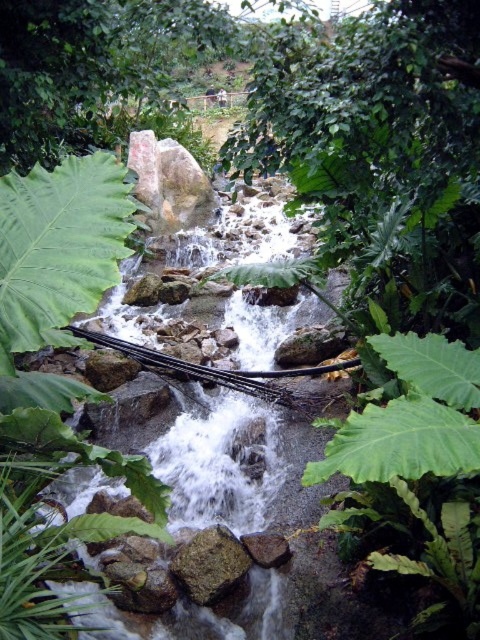
Question: Is green leafy fern at center above brown rough rock at center?

Choices:
 (A) no
 (B) yes

Answer: (B)

Question: Is green leafy fern at center thinner than brown rough rock at center?

Choices:
 (A) yes
 (B) no

Answer: (B)

Question: Among these objects, which one is farthest from the camera?

Choices:
 (A) brown rough rock at center
 (B) green leafy fern at center

Answer: (A)

Question: Can you confirm if green leafy fern at center is positioned above brown rough rock at center?

Choices:
 (A) no
 (B) yes

Answer: (B)

Question: Among these points, which one is nearest to the camera?

Choices:
 (A) (199, 580)
 (B) (116, 528)

Answer: (B)